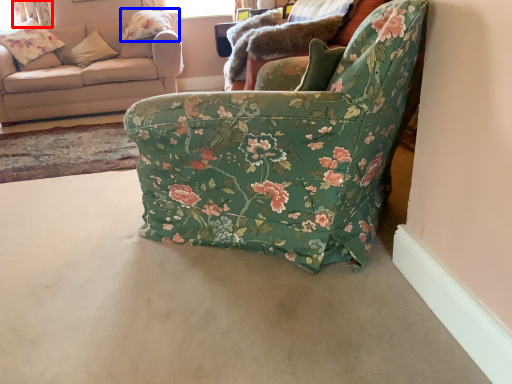
Question: Which object is closer to the camera taking this photo, curtain (highlighted by a red box) or pillow (highlighted by a blue box)?

Choices:
 (A) curtain
 (B) pillow

Answer: (B)